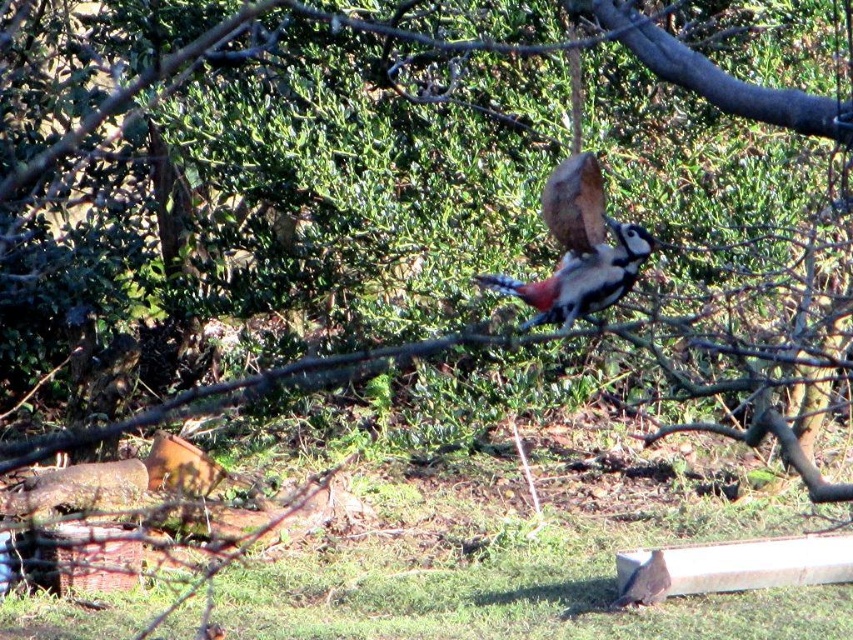
Question: Can you confirm if speckled brown woodpecker at center is positioned above speckled brown bird at center?

Choices:
 (A) no
 (B) yes

Answer: (B)

Question: Which of the following is the closest to the observer?

Choices:
 (A) speckled brown woodpecker at center
 (B) speckled brown bird at center

Answer: (A)

Question: Can you confirm if speckled brown woodpecker at center is positioned to the left of speckled brown bird at center?

Choices:
 (A) no
 (B) yes

Answer: (B)

Question: Can you confirm if speckled brown woodpecker at center is smaller than speckled brown bird at center?

Choices:
 (A) yes
 (B) no

Answer: (B)

Question: Which object is closer to the camera taking this photo?

Choices:
 (A) speckled brown woodpecker at center
 (B) speckled brown bird at center

Answer: (A)